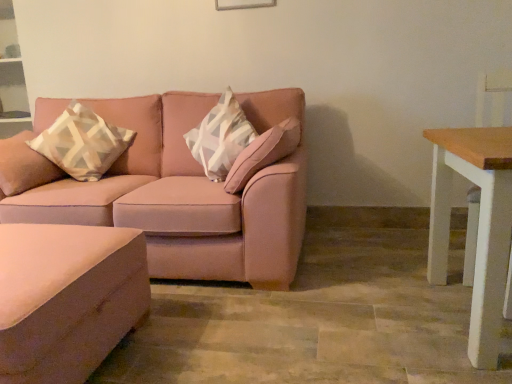
Question: Does matte pink ottoman at lower left have a larger size compared to beige-patterned cushion at left?

Choices:
 (A) no
 (B) yes

Answer: (B)

Question: Considering the relative sizes of matte pink ottoman at lower left and beige-patterned cushion at left in the image provided, is matte pink ottoman at lower left shorter than beige-patterned cushion at left?

Choices:
 (A) yes
 (B) no

Answer: (A)

Question: Does matte pink ottoman at lower left have a greater height compared to beige-patterned cushion at left?

Choices:
 (A) no
 (B) yes

Answer: (A)

Question: Considering the relative sizes of matte pink ottoman at lower left and beige-patterned cushion at left in the image provided, is matte pink ottoman at lower left smaller than beige-patterned cushion at left?

Choices:
 (A) no
 (B) yes

Answer: (A)

Question: Can you confirm if matte pink ottoman at lower left is positioned to the left of beige-patterned cushion at left?

Choices:
 (A) yes
 (B) no

Answer: (B)

Question: Could you tell me if matte pink ottoman at lower left is facing beige-patterned cushion at left?

Choices:
 (A) yes
 (B) no

Answer: (B)

Question: From the image's perspective, is matte pink couch at center beneath beige-patterned cushion at left?

Choices:
 (A) yes
 (B) no

Answer: (A)

Question: From a real-world perspective, is matte pink couch at center under beige-patterned cushion at left?

Choices:
 (A) no
 (B) yes

Answer: (B)

Question: From the image's perspective, is matte pink couch at center over beige-patterned cushion at left?

Choices:
 (A) yes
 (B) no

Answer: (B)

Question: Is matte pink couch at center touching beige-patterned cushion at left?

Choices:
 (A) yes
 (B) no

Answer: (B)

Question: Does matte pink couch at center have a lesser width compared to beige-patterned cushion at left?

Choices:
 (A) no
 (B) yes

Answer: (A)

Question: Can you confirm if matte pink couch at center is bigger than beige-patterned cushion at left?

Choices:
 (A) yes
 (B) no

Answer: (A)

Question: Can you confirm if wooden white table at right is taller than beige-patterned cushion at left?

Choices:
 (A) yes
 (B) no

Answer: (A)